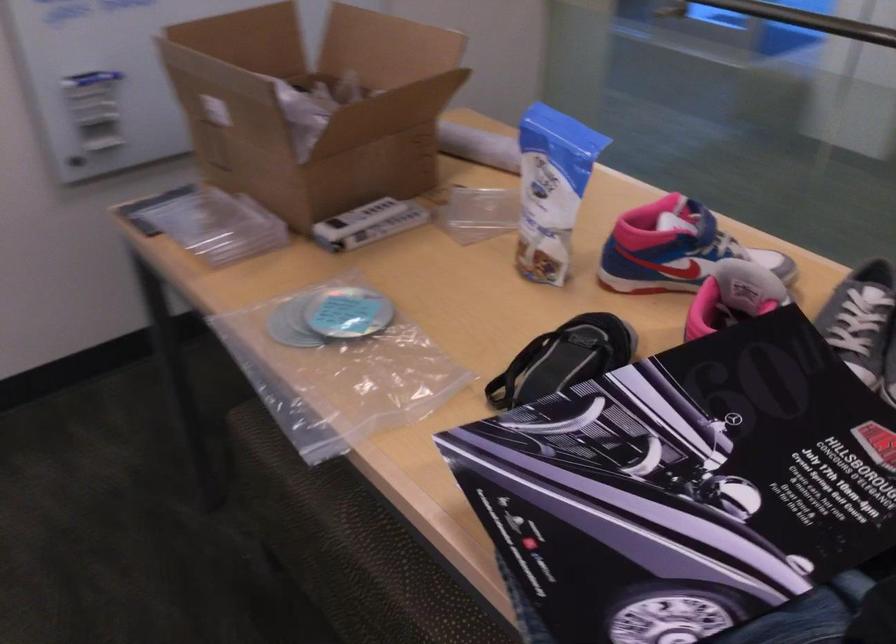
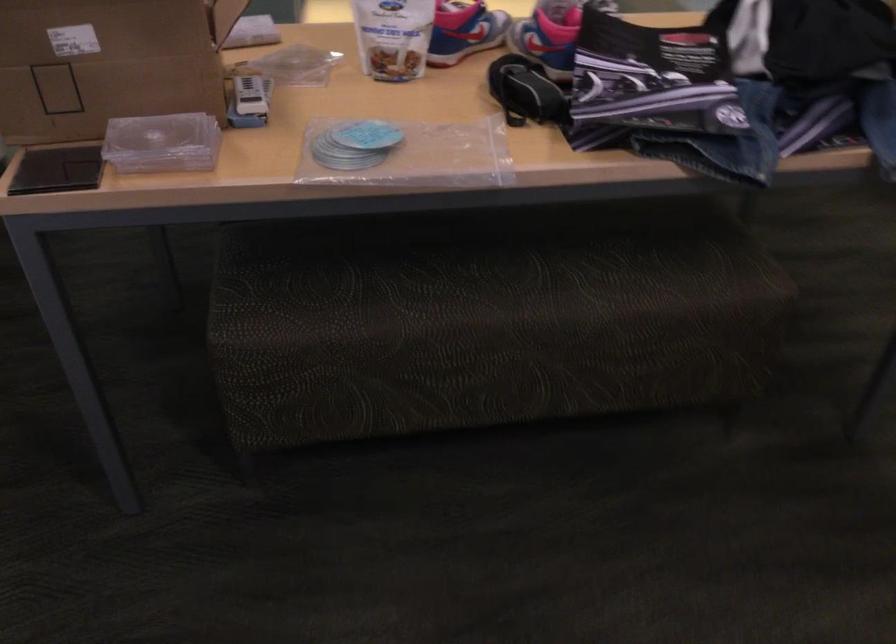
The point at (x=238, y=142) is marked in the first image. Where is the corresponding point in the second image?

(107, 62)